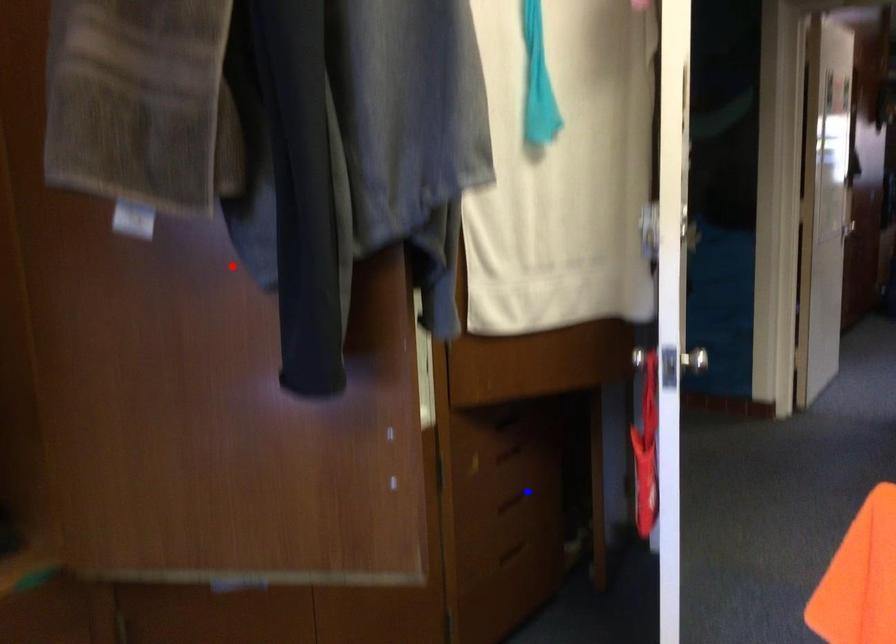
Question: Which of the two points in the image is closer to the camera?

Choices:
 (A) Blue point is closer.
 (B) Red point is closer.

Answer: (B)